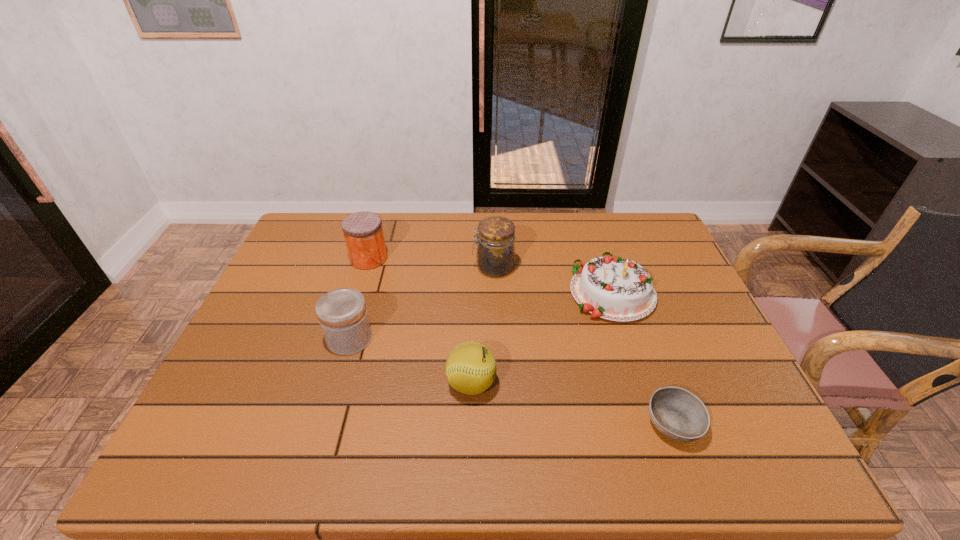
In the image, there is a desktop. Where is `free space at the right edge`? Image resolution: width=960 pixels, height=540 pixels. free space at the right edge is located at coordinates (671, 352).

The image size is (960, 540). In the image, there is a desktop. Identify the location of blank space at the far left corner. (333, 246).

You are a GUI agent. You are given a task and a screenshot of the screen. Output one action in this format:
    pyautogui.click(x=<x>, y=<y>)
    Task: Click on the free space at the near left corner
    The image size is (960, 540).
    Given the screenshot: What is the action you would take?
    pyautogui.click(x=198, y=470)

I want to click on vacant point located between the nearest jar and the softball, so 411,361.

The image size is (960, 540). What are the coordinates of `free space between the cake and the nearest jar` in the screenshot? It's located at (481, 315).

Find the location of a particular element. This screenshot has width=960, height=540. free space between the softball and the bowl is located at coordinates (572, 403).

Identify the location of unoccupied position between the cake and the nearest jar. The image size is (960, 540). tap(481, 315).

Image resolution: width=960 pixels, height=540 pixels. I want to click on free space between the cake and the bowl, so click(x=643, y=358).

The image size is (960, 540). In order to click on blank region between the nearest jar and the bowl in this screenshot , I will do `click(512, 381)`.

You are a GUI agent. You are given a task and a screenshot of the screen. Output one action in this format:
    pyautogui.click(x=<x>, y=<y>)
    Task: Click on the blank region between the rightmost jar and the cake
    The height and width of the screenshot is (540, 960).
    Given the screenshot: What is the action you would take?
    pyautogui.click(x=553, y=280)